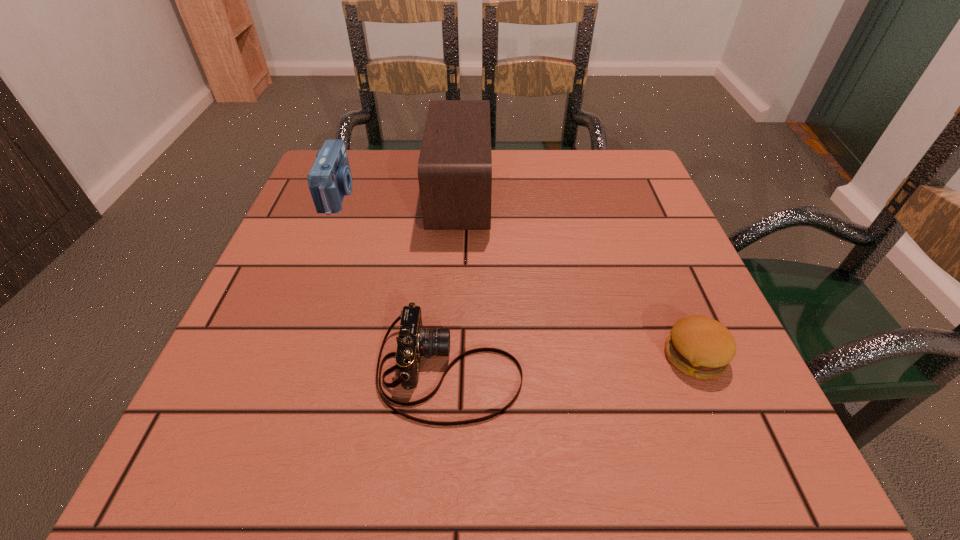
Locate an element on the screen. The image size is (960, 540). radio receiver situated at the far edge is located at coordinates (455, 163).

Find the location of a particular element. camera situated at the far edge is located at coordinates (329, 179).

Find the location of a particular element. The image size is (960, 540). object located in the near edge section of the desktop is located at coordinates (413, 341).

Where is `object located in the left edge section of the desktop`? object located in the left edge section of the desktop is located at coordinates (329, 179).

In order to click on object that is at the right edge in this screenshot , I will do tap(701, 347).

The height and width of the screenshot is (540, 960). What are the coordinates of `object that is at the far left corner` in the screenshot? It's located at (x=329, y=179).

I want to click on vacant space at the far edge of the desktop, so click(564, 159).

I want to click on free spot at the near edge of the desktop, so click(x=444, y=429).

You are a GUI agent. You are given a task and a screenshot of the screen. Output one action in this format:
    pyautogui.click(x=<x>, y=<y>)
    Task: Click on the free space at the left edge of the desktop
    This screenshot has height=540, width=960.
    Given the screenshot: What is the action you would take?
    pyautogui.click(x=326, y=352)

This screenshot has height=540, width=960. I want to click on vacant region at the right edge, so click(660, 245).